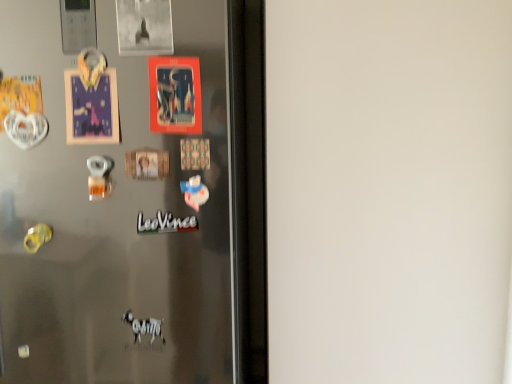
I want to click on matte plastic postcard at center, so click(x=175, y=95).

The height and width of the screenshot is (384, 512). Identify the location of matte plastic postcard at center. (175, 95).

Is matte plastic postcard at center wider or thinner than satin metallic fridge at center?

Clearly, matte plastic postcard at center has less width compared to satin metallic fridge at center.

In the image, there is a matte plastic postcard at center. Identify the location of refrigerator below it (from a real-world perspective). (128, 196).

Based on the photo, which is behind, matte plastic postcard at center or satin metallic fridge at center?

matte plastic postcard at center is further away from the camera.

Measure the distance between satin metallic fridge at center and white matte sticker at center.

satin metallic fridge at center is 5.34 feet away from white matte sticker at center.

Is the position of satin metallic fridge at center more distant than that of white matte sticker at center?

No, satin metallic fridge at center is closer to the viewer.

Is satin metallic fridge at center beside white matte sticker at center?

No, satin metallic fridge at center is not touching white matte sticker at center.

How many degrees apart are the facing directions of satin metallic fridge at center and white matte sticker at center?

satin metallic fridge at center and white matte sticker at center are facing 0.00193 degrees away from each other.

Which of these two, white matte sticker at center or satin metallic fridge at center, is wider?

satin metallic fridge at center.

Is satin metallic fridge at center at the back of white matte sticker at center?

Yes.

Does white matte sticker at center touch satin metallic fridge at center?

white matte sticker at center and satin metallic fridge at center are clearly separated.

This screenshot has width=512, height=384. I want to click on writing behind the satin metallic fridge at center, so click(x=166, y=223).

Can you confirm if matte plastic postcard at center is thinner than white matte sticker at center?

In fact, matte plastic postcard at center might be wider than white matte sticker at center.

Is matte plastic postcard at center directly adjacent to white matte sticker at center?

matte plastic postcard at center is not next to white matte sticker at center, and they're not touching.

From a real-world perspective, which is physically above, matte plastic postcard at center or white matte sticker at center?

In real-world perspective, matte plastic postcard at center is above.

Considering the points (151, 94) and (174, 223), which point is in front, point (151, 94) or point (174, 223)?

The point (151, 94) is more forward.

Is satin metallic fridge at center far away from matte plastic postcard at center?

That's right, there is a large distance between satin metallic fridge at center and matte plastic postcard at center.

Does satin metallic fridge at center have a lesser height compared to matte plastic postcard at center?

In fact, satin metallic fridge at center may be taller than matte plastic postcard at center.

Identify the location of postcard lying above the satin metallic fridge at center (from the image's perspective). (175, 95).

Can you tell me how much satin metallic fridge at center and matte plastic postcard at center differ in facing direction?

The angular difference between satin metallic fridge at center and matte plastic postcard at center is 4.33 degrees.

Which object is wider, white matte sticker at center or matte plastic postcard at center?

With larger width is matte plastic postcard at center.

Would you say white matte sticker at center is to the left or to the right of matte plastic postcard at center in the picture?

From the image, it's evident that white matte sticker at center is to the left of matte plastic postcard at center.

Locate an element on the screen. This screenshot has height=384, width=512. writing below the matte plastic postcard at center (from a real-world perspective) is located at coordinates (166, 223).

Where is `postcard behind the satin metallic fridge at center`? The image size is (512, 384). postcard behind the satin metallic fridge at center is located at coordinates tap(175, 95).

The height and width of the screenshot is (384, 512). Identify the location of refrigerator located below the white matte sticker at center (from the image's perspective). (128, 196).

Based on their spatial positions, is white matte sticker at center or satin metallic fridge at center closer to matte plastic postcard at center?

white matte sticker at center.

Looking at the image, which one is located closer to satin metallic fridge at center, white matte sticker at center or matte plastic postcard at center?

The object closer to satin metallic fridge at center is matte plastic postcard at center.

Looking at this image, from the image, which object appears to be farther from white matte sticker at center, satin metallic fridge at center or matte plastic postcard at center?

satin metallic fridge at center lies further to white matte sticker at center than the other object.

Based on their spatial positions, is satin metallic fridge at center or white matte sticker at center closer to matte plastic postcard at center?

white matte sticker at center is closer to matte plastic postcard at center.

Based on their spatial positions, is matte plastic postcard at center or satin metallic fridge at center further from white matte sticker at center?

Among the two, satin metallic fridge at center is located further to white matte sticker at center.

From the image, which object appears to be farther from satin metallic fridge at center, matte plastic postcard at center or white matte sticker at center?

Based on the image, white matte sticker at center appears to be further to satin metallic fridge at center.

Locate an element on the screen. The height and width of the screenshot is (384, 512). writing between matte plastic postcard at center and satin metallic fridge at center in the up-down direction is located at coordinates (166, 223).